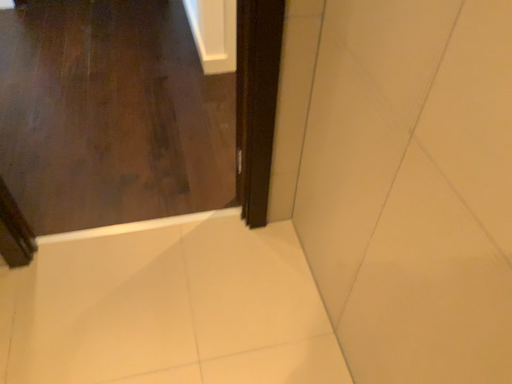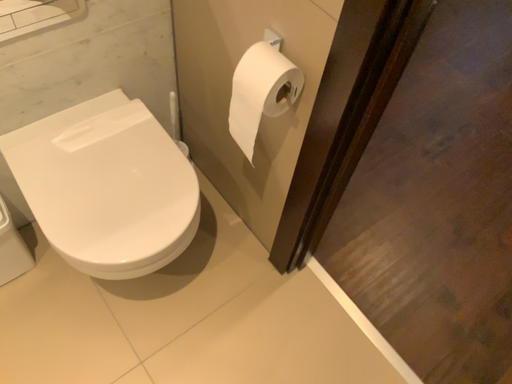
Question: Which way did the camera rotate in the video?

Choices:
 (A) rotated downward
 (B) rotated upward

Answer: (B)